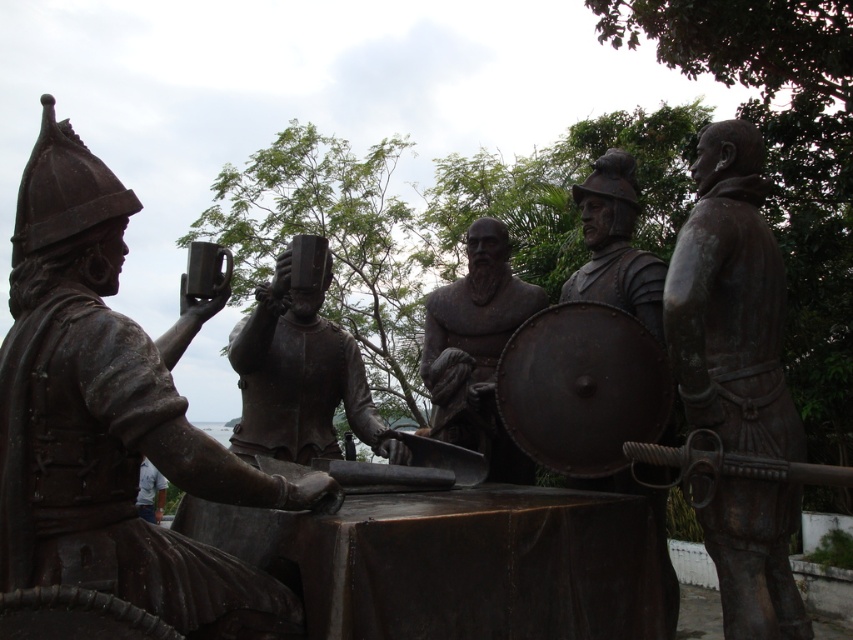
Does point (737, 435) come behind point (456, 323)?

No, it is in front of (456, 323).

Locate an element on the screen. The height and width of the screenshot is (640, 853). bronze shield at right is located at coordinates (730, 301).

Which is in front, point (741, 269) or point (453, 368)?

Point (741, 269)

The image size is (853, 640). In order to click on bronze shield at right in this screenshot , I will do `click(730, 301)`.

Who is taller, bronze helmet at center or bronze shield at center?

bronze shield at center is taller.

Is bronze helmet at center positioned in front of bronze shield at center?

Yes, it is in front of bronze shield at center.

The height and width of the screenshot is (640, 853). What do you see at coordinates (300, 378) in the screenshot? I see `bronze helmet at center` at bounding box center [300, 378].

The width and height of the screenshot is (853, 640). In order to click on bronze helmet at center in this screenshot , I will do `click(300, 378)`.

Which is more to the right, bronze shield at right or bronze helmet at center?

bronze shield at right

Can you confirm if bronze shield at right is positioned to the left of bronze helmet at center?

In fact, bronze shield at right is to the right of bronze helmet at center.

Does point (753, 600) lie behind point (256, 435)?

No.

This screenshot has width=853, height=640. What are the coordinates of `bronze shield at right` in the screenshot? It's located at (730, 301).